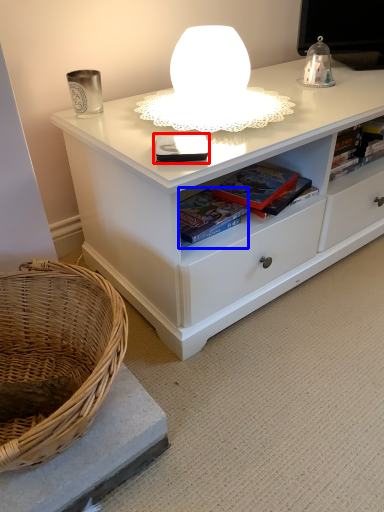
Question: Among these objects, which one is nearest to the camera, book (highlighted by a red box) or book (highlighted by a blue box)?

Choices:
 (A) book
 (B) book

Answer: (A)